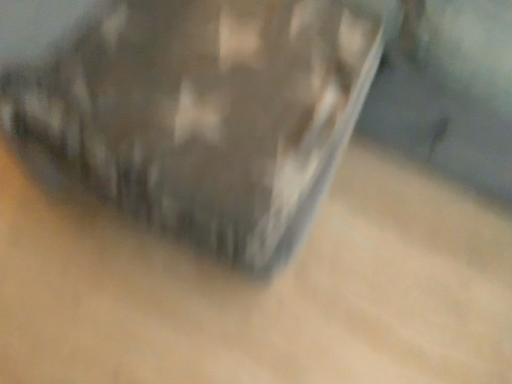
What do you see at coordinates (206, 113) in the screenshot?
I see `metallic textured brush at center` at bounding box center [206, 113].

In order to face metallic textured brush at center, should I rotate leftwards or rightwards?

Rotate right and turn 1.379 degrees.

Image resolution: width=512 pixels, height=384 pixels. Identify the location of metallic textured brush at center. (206, 113).

Where is `metallic textured brush at center`? metallic textured brush at center is located at coordinates (206, 113).